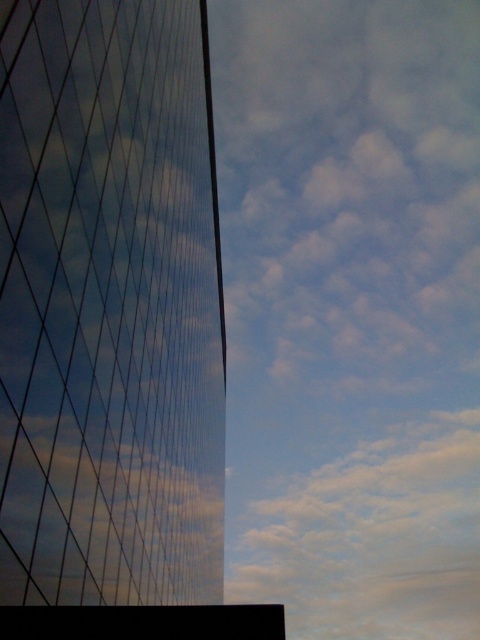
Question: Does reflective glass building at left have a lesser width compared to white fluffy cloud at upper center?

Choices:
 (A) no
 (B) yes

Answer: (B)

Question: Which point is closer to the camera taking this photo?

Choices:
 (A) (465, 604)
 (B) (74, 488)

Answer: (B)

Question: Can you confirm if reflective glass building at left is positioned to the right of white fluffy cloud at upper center?

Choices:
 (A) yes
 (B) no

Answer: (B)

Question: Does reflective glass building at left have a lesser width compared to white fluffy cloud at upper center?

Choices:
 (A) yes
 (B) no

Answer: (A)